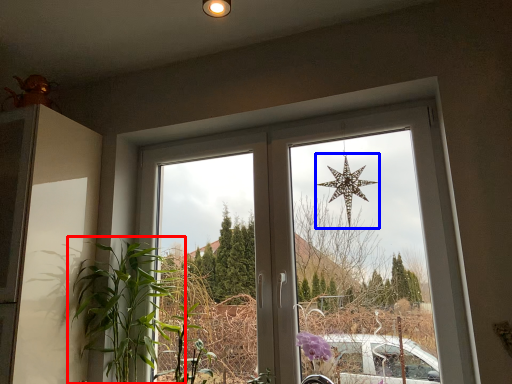
Question: Which point is closer to the camera, houseplant (highlighted by a red box) or star (highlighted by a blue box)?

Choices:
 (A) houseplant
 (B) star

Answer: (A)